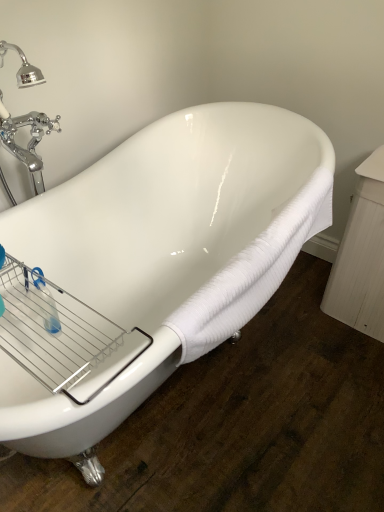
This screenshot has height=512, width=384. What are the coordinates of `white glossy bathtub at center` in the screenshot? It's located at (149, 267).

What do you see at coordinates (149, 267) in the screenshot? This screenshot has height=512, width=384. I see `white glossy bathtub at center` at bounding box center [149, 267].

Locate an element on the screen. Image resolution: width=384 pixels, height=512 pixels. white glossy bathtub at center is located at coordinates (149, 267).